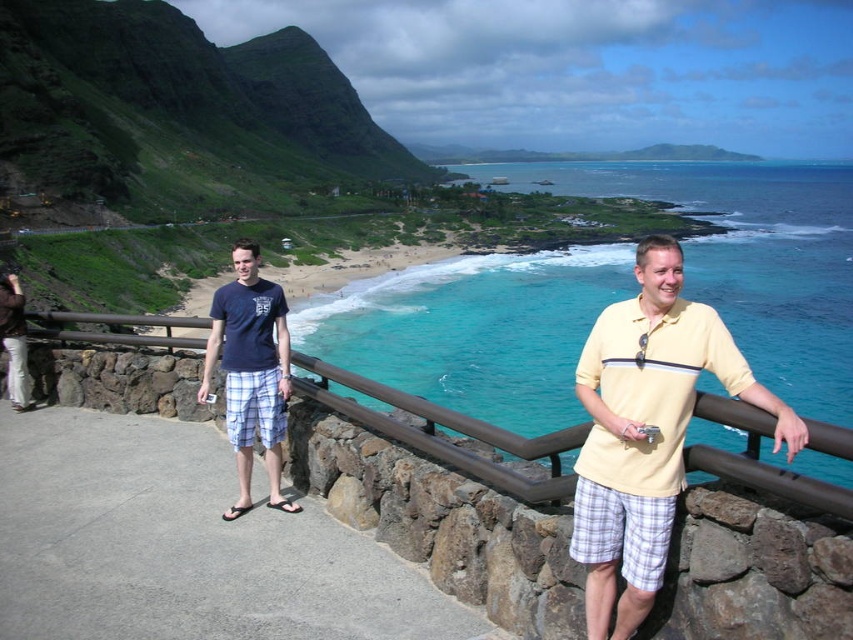
Consider the image. Does brown wood rail at center appear on the right side of matte black camera at lower left?

Indeed, brown wood rail at center is positioned on the right side of matte black camera at lower left.

Which is in front, point (306, 360) or point (3, 276)?

Positioned in front is point (306, 360).

The image size is (853, 640). Find the location of `brown wood rail at center`. brown wood rail at center is located at coordinates (445, 428).

Does yellow cotton shirt at center have a greater height compared to matte black camera at lower left?

Correct, yellow cotton shirt at center is much taller as matte black camera at lower left.

Does point (631, 355) come behind point (20, 305)?

No, (631, 355) is closer to viewer.

Identify the location of yellow cotton shirt at center. (646, 429).

Is matte blue t-shirt at left to the left of matte black camera at lower left from the viewer's perspective?

In fact, matte blue t-shirt at left is to the right of matte black camera at lower left.

Where is `matte blue t-shirt at left`? The height and width of the screenshot is (640, 853). matte blue t-shirt at left is located at coordinates (251, 371).

Image resolution: width=853 pixels, height=640 pixels. I want to click on matte blue t-shirt at left, so click(x=251, y=371).